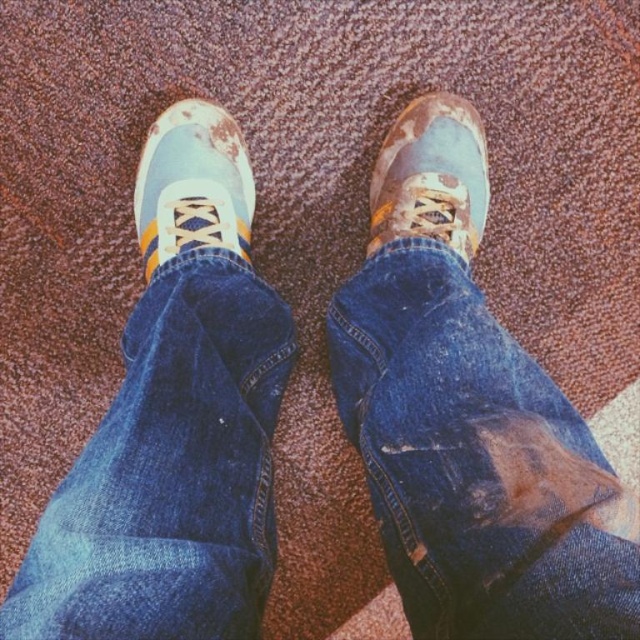
You are a fashion designer analyzing a photo of someone wearing ripped denim jeans at lower right and a blue suede sneaker at center. Based on the spatial relationship between these items, can you determine which one extends higher up the leg?

The ripped denim jeans at lower right extend higher up the leg than the blue suede sneaker at center because the ripped denim jeans at lower right is taller than blue suede sneaker at center.

You are a photographer trying to capture the matte blue sneaker at center in focus. If your camera has a depth of field that can sharply capture objects within 30 inches, will the sneaker be in focus?

The matte blue sneaker at center is 37.14 inches away from the camera, which is beyond the 30 inch depth of field range. Therefore, the sneaker will not be in focus.

You are trying to determine if the ripped denim jeans at lower right can be folded neatly into the matte blue sneaker at center. Based on their widths, is this possible?

The ripped denim jeans at lower right is wider than the matte blue sneaker at center, so it cannot be folded to fit inside the sneaker.